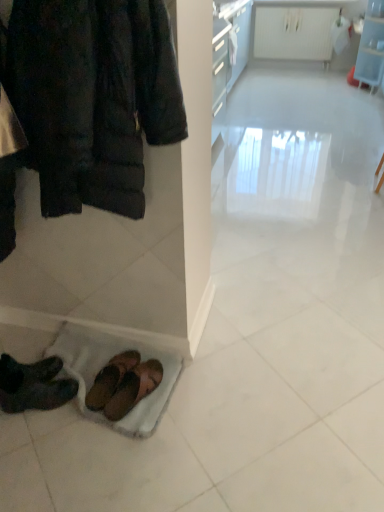
Question: From the image's perspective, would you say white glossy radiator at upper center, the second shelf from the right, is shown under brown leather sandals at lower left, the 3th footwear from the left?

Choices:
 (A) yes
 (B) no

Answer: (B)

Question: Does white glossy radiator at upper center, the second shelf from the right, have a larger size compared to brown leather sandals at lower left, the 3th footwear from the left?

Choices:
 (A) yes
 (B) no

Answer: (A)

Question: Could you tell me if white glossy radiator at upper center, the first shelf positioned from the left, is turned towards brown leather sandals at lower left, the 3th footwear from the left?

Choices:
 (A) yes
 (B) no

Answer: (A)

Question: From a real-world perspective, is white glossy radiator at upper center, the second shelf from the right, beneath brown leather sandals at lower left, the 3th footwear from the left?

Choices:
 (A) yes
 (B) no

Answer: (B)

Question: Is the surface of white glossy radiator at upper center, the second shelf from the right, in direct contact with brown leather sandals at lower left, the 3th footwear from the left?

Choices:
 (A) no
 (B) yes

Answer: (A)

Question: Does point (79, 116) appear closer or farther from the camera than point (46, 357)?

Choices:
 (A) farther
 (B) closer

Answer: (B)

Question: Is dark brown quilted jacket at upper left wider or thinner than dark brown leather shoes at lower left, the 3th footwear when ordered from right to left?

Choices:
 (A) thin
 (B) wide

Answer: (B)

Question: From a real-world perspective, is dark brown quilted jacket at upper left positioned above or below dark brown leather shoes at lower left, the first footwear positioned from the left?

Choices:
 (A) above
 (B) below

Answer: (A)

Question: Would you say dark brown quilted jacket at upper left is to the left or to the right of dark brown leather shoes at lower left, the 3th footwear when ordered from right to left, in the picture?

Choices:
 (A) right
 (B) left

Answer: (A)

Question: In the image, is clear plastic shelf at upper right, which ranks as the 1th shelf in right-to-left order, on the left side or the right side of brown suede sandals at lower center, which ranks as the second footwear in left-to-right order?

Choices:
 (A) left
 (B) right

Answer: (B)

Question: Is clear plastic shelf at upper right, placed as the second shelf when sorted from left to right, inside the boundaries of brown suede sandals at lower center, which is counted as the 2th footwear, starting from the right, or outside?

Choices:
 (A) inside
 (B) outside

Answer: (B)

Question: In terms of width, does clear plastic shelf at upper right, which ranks as the 1th shelf in right-to-left order, look wider or thinner when compared to brown suede sandals at lower center, which is counted as the 2th footwear, starting from the right?

Choices:
 (A) thin
 (B) wide

Answer: (B)

Question: Is clear plastic shelf at upper right, which ranks as the 1th shelf in right-to-left order, in front of or behind brown suede sandals at lower center, which ranks as the second footwear in left-to-right order, in the image?

Choices:
 (A) front
 (B) behind

Answer: (B)

Question: In terms of size, does dark brown leather shoes at lower left, the 3th footwear when ordered from right to left, appear bigger or smaller than brown leather sandals at lower left, the first footwear viewed from the right?

Choices:
 (A) big
 (B) small

Answer: (A)

Question: From the image's perspective, is dark brown leather shoes at lower left, the 3th footwear when ordered from right to left, above or below brown leather sandals at lower left, the first footwear viewed from the right?

Choices:
 (A) below
 (B) above

Answer: (B)